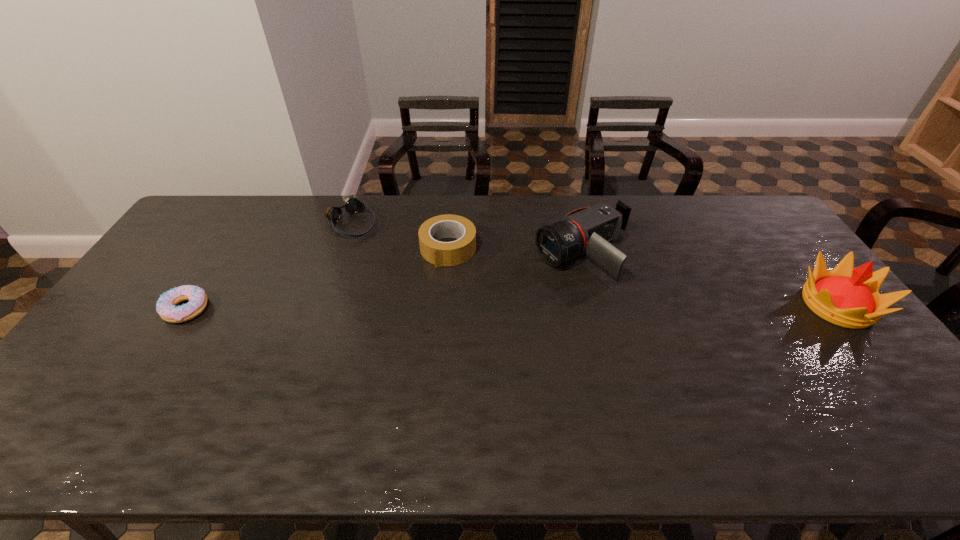
Identify the location of vacant spot on the desktop that is between the shortest object and the rightmost object and is positioned on the lens of the fourth shortest object. This screenshot has height=540, width=960. (462, 307).

Where is `free space on the desktop that is between the leftmost object and the crown and is positioned at the edge of the third object from left to right`? free space on the desktop that is between the leftmost object and the crown and is positioned at the edge of the third object from left to right is located at coordinates (420, 308).

Locate an element on the screen. vacant space on the desktop that is between the leftmost object and the tallest object and is positioned through the lenses of the goggles is located at coordinates (455, 307).